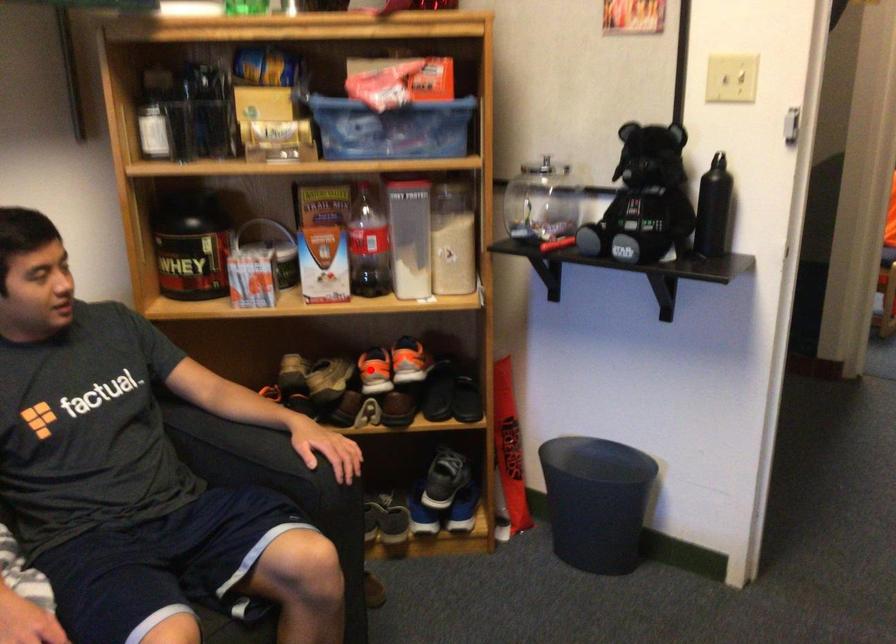
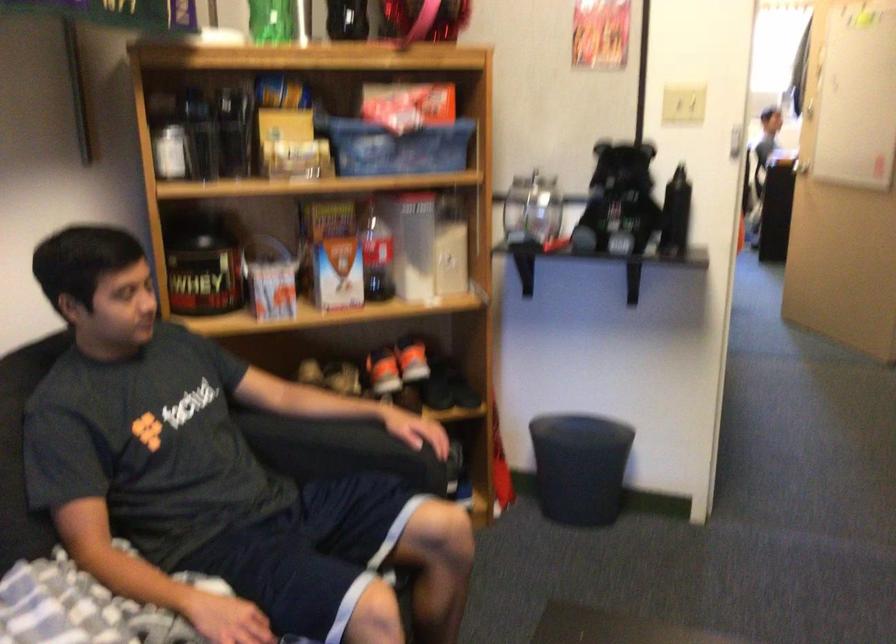
Where in the second image is the point corresponding to the highlighted location from the first image?

(383, 371)